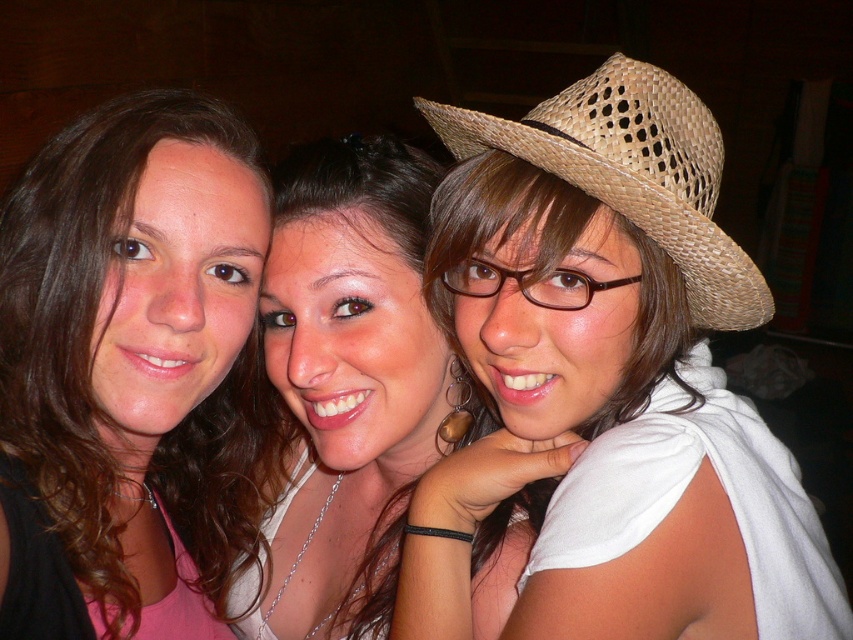
Question: Does matte pink shirt at left have a greater width compared to woven straw cowboy hat at upper right?

Choices:
 (A) yes
 (B) no

Answer: (B)

Question: Considering the real-world distances, which object is closest to the matte pink shirt at left?

Choices:
 (A) matte white shirt at center
 (B) woven straw cowboy hat at upper right

Answer: (A)

Question: Among these points, which one is nearest to the camera?

Choices:
 (A) (402, 272)
 (B) (744, 324)

Answer: (A)

Question: Which object appears farthest from the camera in this image?

Choices:
 (A) matte pink shirt at left
 (B) woven straw cowboy hat at upper right
 (C) matte white shirt at center

Answer: (C)

Question: Is matte pink shirt at left closer to camera compared to woven straw cowboy hat at upper right?

Choices:
 (A) yes
 (B) no

Answer: (B)

Question: Observing the image, what is the correct spatial positioning of matte pink shirt at left in reference to matte white shirt at center?

Choices:
 (A) right
 (B) left

Answer: (B)